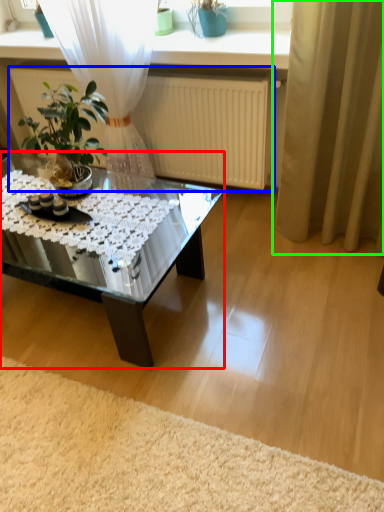
Question: Which is farther away from coffee table (highlighted by a red box)? radiator (highlighted by a blue box) or curtain (highlighted by a green box)?

Choices:
 (A) radiator
 (B) curtain

Answer: (B)